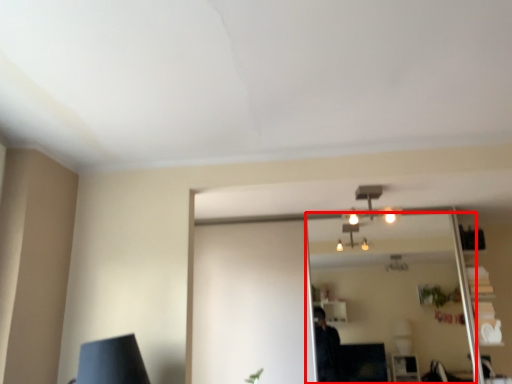
Question: From the image's perspective, where is mirror (annotated by the red box) located in relation to fixture in the image?

Choices:
 (A) above
 (B) below

Answer: (B)